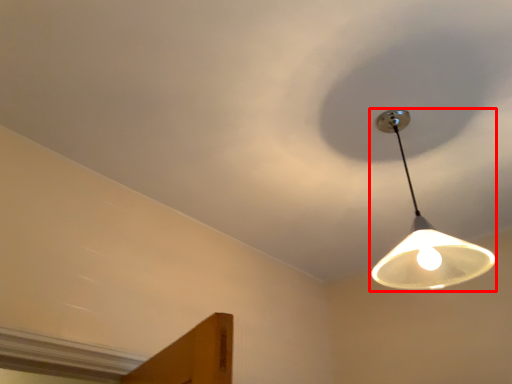
Question: From the image's perspective, what is the correct spatial relationship of lamp (annotated by the red box) in relation to cloud?

Choices:
 (A) below
 (B) above

Answer: (A)